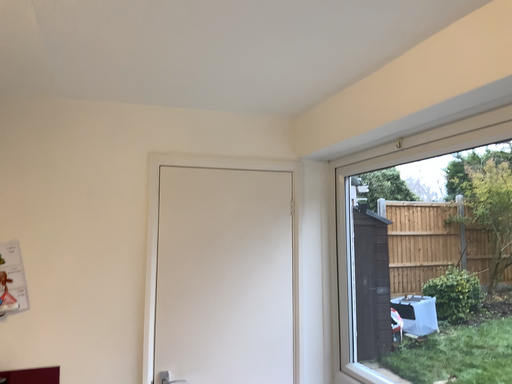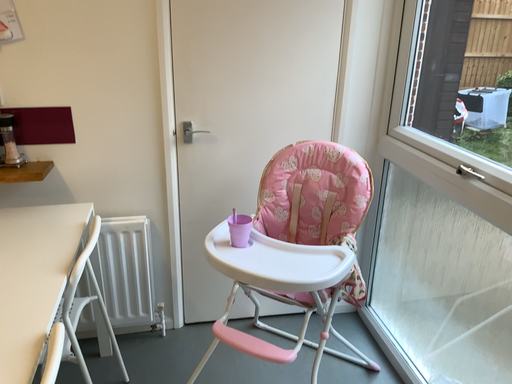
Question: How did the camera likely rotate when shooting the video?

Choices:
 (A) rotated left
 (B) rotated right

Answer: (A)